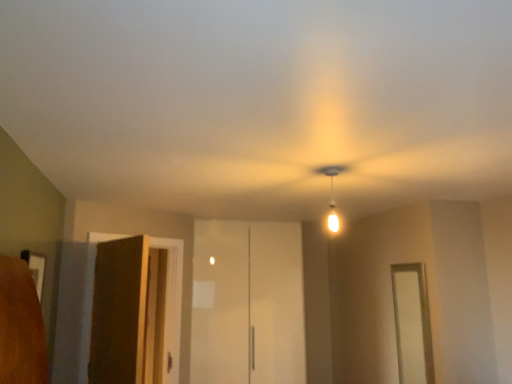
Question: From a real-world perspective, is matte white bulb at center physically located above or below brown wood elevator at left, the second elevator from the right?

Choices:
 (A) below
 (B) above

Answer: (B)

Question: Based on their positions, is matte white bulb at center located to the left or right of brown wood elevator at left, the first elevator viewed from the left?

Choices:
 (A) left
 (B) right

Answer: (B)

Question: Estimate the real-world distances between objects in this image. Which object is farther from the brown wood elevator at left, the second elevator from the right?

Choices:
 (A) white glossy cabinet at center, the 2th elevator from the left
 (B) white glossy door at right
 (C) matte white bulb at center

Answer: (B)

Question: Based on their relative distances, which object is nearer to the matte white bulb at center?

Choices:
 (A) white glossy cabinet at center, the first elevator from the back
 (B) white glossy door at right
 (C) brown wood elevator at left, the second elevator from the right

Answer: (B)